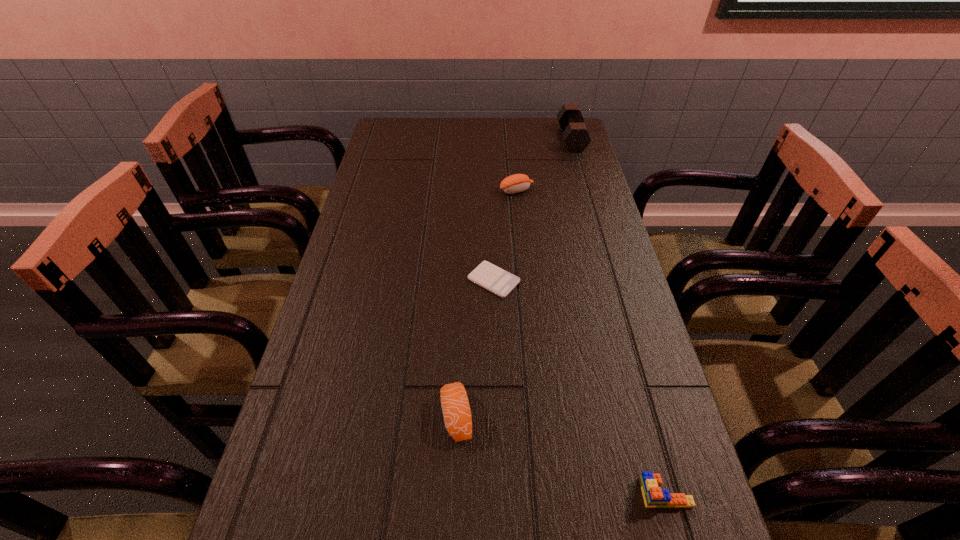
Image resolution: width=960 pixels, height=540 pixels. I want to click on empty space between the farther sushi and the Lego, so click(591, 341).

The width and height of the screenshot is (960, 540). I want to click on the fourth closest object to the left sushi, so [575, 135].

Choose which object is the nearest neighbor to the second farthest object. Please provide its 2D coordinates. Your answer should be formatted as a tuple, i.e. [(x, y)], where the tuple contains the x and y coordinates of a point satisfying the conditions above.

[(575, 135)]

Identify the location of free point that satisfies the following two spatial constraints: 1. on the back side of the shortest object; 2. on the right side of the nearer sushi. The image size is (960, 540). (462, 280).

Where is `free space that satisfies the following two spatial constraints: 1. on the back side of the third farthest object; 2. on the left side of the farthest object`? free space that satisfies the following two spatial constraints: 1. on the back side of the third farthest object; 2. on the left side of the farthest object is located at coordinates tap(490, 139).